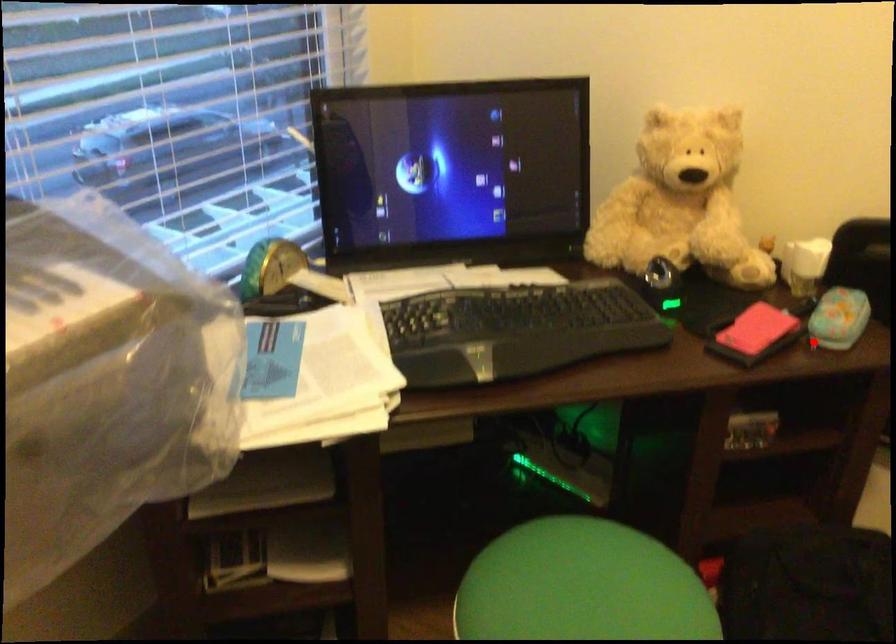
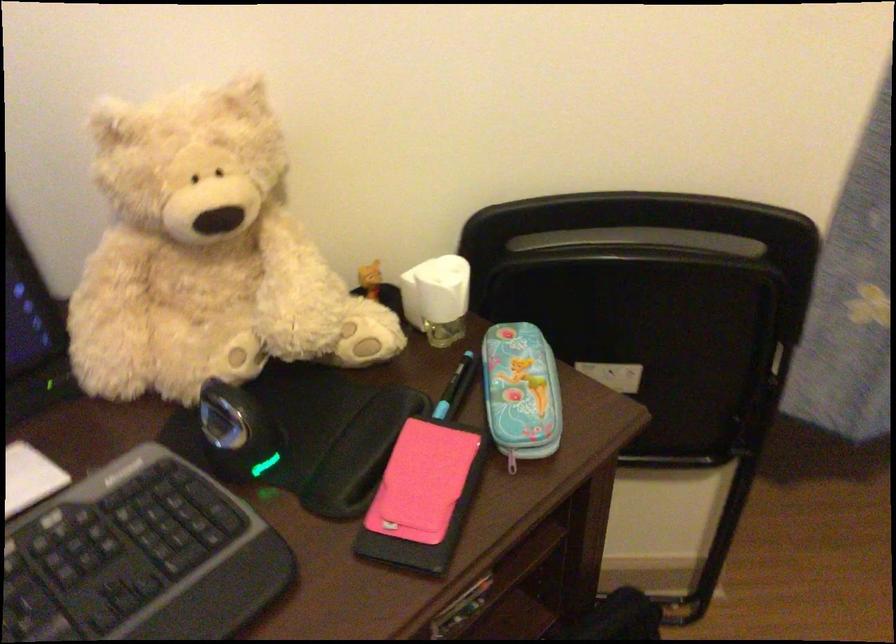
Question: I am providing you with two images of the same scene from different viewpoints. In image1, a red point is highlighted. Considering the same 3D point in image2, which of the following is correct?

Choices:
 (A) It is closer
 (B) It is farther

Answer: (A)